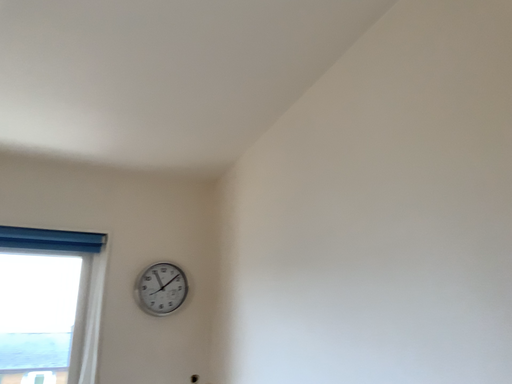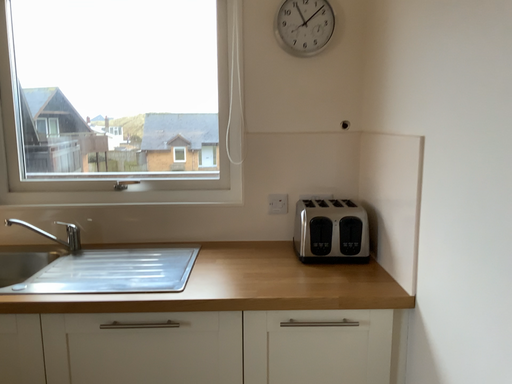
Question: Which way did the camera rotate in the video?

Choices:
 (A) rotated right
 (B) rotated left

Answer: (B)